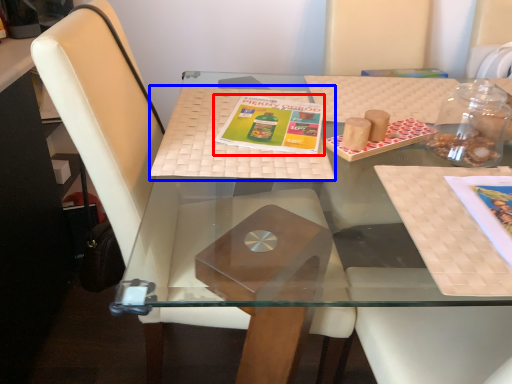
Question: Which object is closer to the camera taking this photo, book cover (highlighted by a red box) or place mat (highlighted by a blue box)?

Choices:
 (A) book cover
 (B) place mat

Answer: (B)